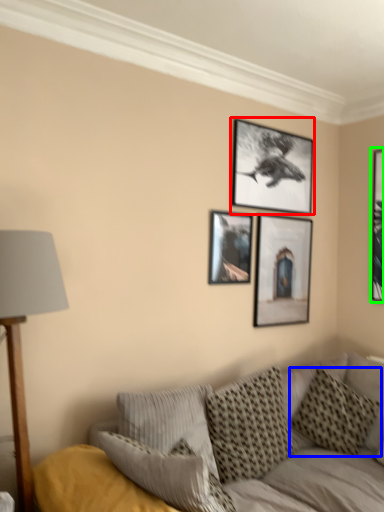
Question: Estimate the real-world distances between objects in this image. Which object is closer to picture frame (highlighted by a red box), pillow (highlighted by a blue box) or picture frame (highlighted by a green box)?

Choices:
 (A) pillow
 (B) picture frame

Answer: (B)